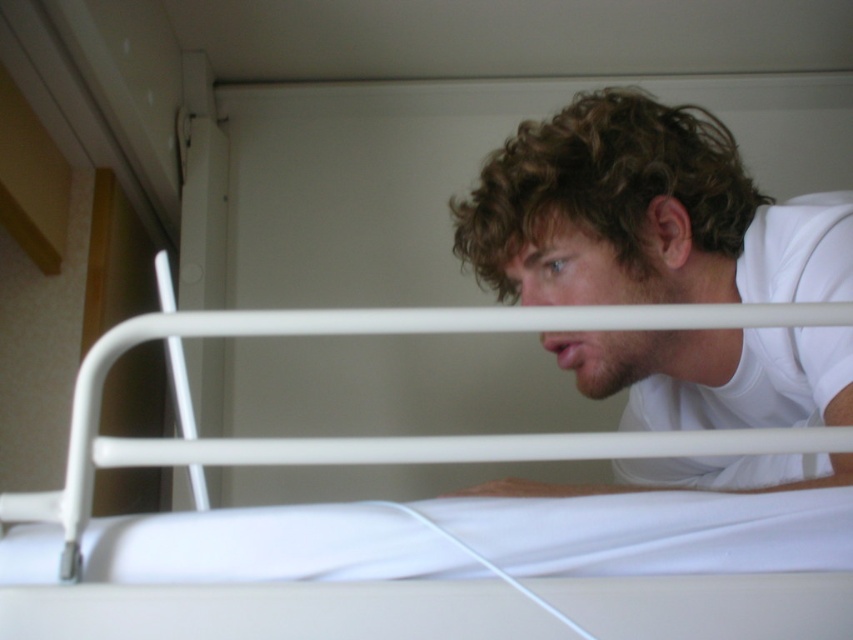
Is white matte shirt at upper right to the right of white metal bunk bed at center from the viewer's perspective?

Yes, white matte shirt at upper right is to the right of white metal bunk bed at center.

Can you confirm if white matte shirt at upper right is positioned below white metal bunk bed at center?

Incorrect, white matte shirt at upper right is not positioned below white metal bunk bed at center.

Which is in front, point (555, 196) or point (413, 589)?

Positioned in front is point (413, 589).

Identify the location of white matte shirt at upper right. The height and width of the screenshot is (640, 853). (642, 214).